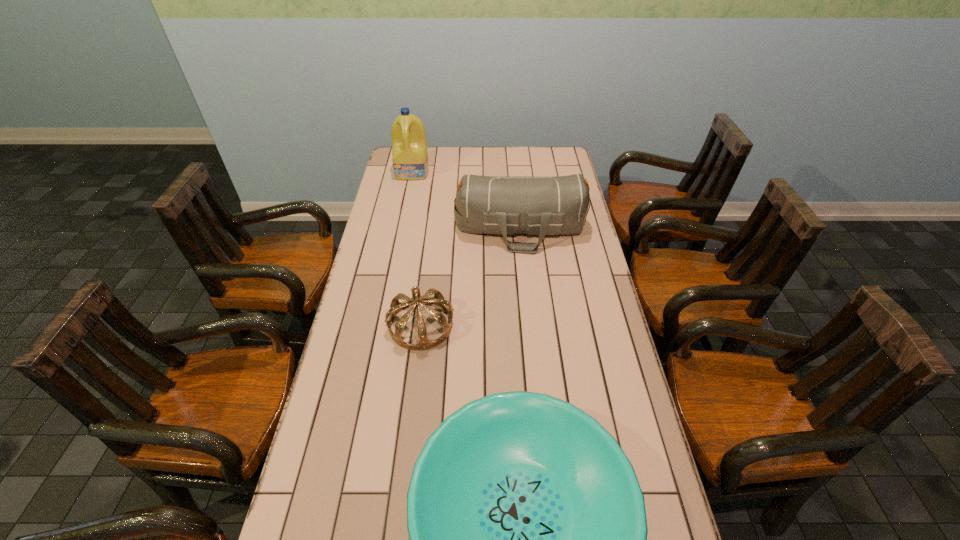
The width and height of the screenshot is (960, 540). What are the coordinates of `free space that is in between the tallest object and the second nearest object` in the screenshot? It's located at (417, 248).

This screenshot has height=540, width=960. Identify the location of vacant area between the tiara and the duffel bag. (470, 276).

Where is `object that is the third closest to the farthest object`? object that is the third closest to the farthest object is located at coordinates (528, 534).

Locate an element on the screen. The height and width of the screenshot is (540, 960). object that is the second closest one to the second nearest object is located at coordinates (559, 205).

Locate an element on the screen. This screenshot has width=960, height=540. free space in the image that satisfies the following two spatial constraints: 1. on the label of the second shortest object; 2. on the left side of the detergent is located at coordinates (382, 325).

Where is `free space that satisfies the following two spatial constraints: 1. on the label of the farthest object; 2. on the left side of the duffel bag`? free space that satisfies the following two spatial constraints: 1. on the label of the farthest object; 2. on the left side of the duffel bag is located at coordinates (402, 228).

Where is `vacant space that satisfies the following two spatial constraints: 1. on the label of the farthest object; 2. on the right side of the tiara`? Image resolution: width=960 pixels, height=540 pixels. vacant space that satisfies the following two spatial constraints: 1. on the label of the farthest object; 2. on the right side of the tiara is located at coordinates (382, 325).

Where is `vacant space that satisfies the following two spatial constraints: 1. on the label of the farthest object; 2. on the left side of the third farthest object`? This screenshot has height=540, width=960. vacant space that satisfies the following two spatial constraints: 1. on the label of the farthest object; 2. on the left side of the third farthest object is located at coordinates (382, 325).

You are a GUI agent. You are given a task and a screenshot of the screen. Output one action in this format:
    pyautogui.click(x=<x>, y=<y>)
    Task: Click on the vacant space that satisfies the following two spatial constraints: 1. on the label of the tiara; 2. on the right side of the tallest object
    The width and height of the screenshot is (960, 540).
    Given the screenshot: What is the action you would take?
    pyautogui.click(x=382, y=325)